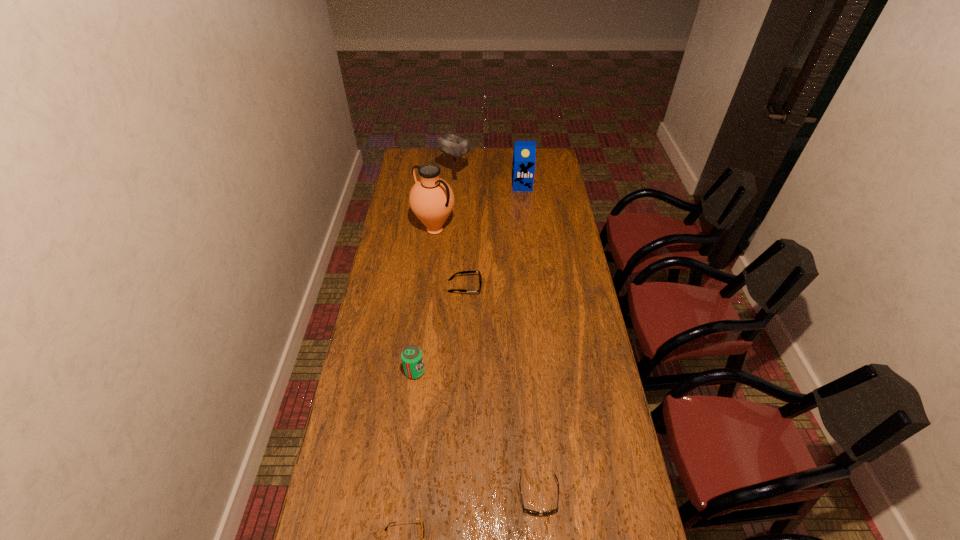
At what (x,y) coordinates should I click in order to perform the action: click on free space located on the back of the mallet. Please return your answer as a coordinate pair (x, y). The height and width of the screenshot is (540, 960). Looking at the image, I should click on (456, 166).

What are the coordinates of `free space located with the cap open on the carton` in the screenshot? It's located at (527, 229).

Identify the location of free space located on the front-facing side of the fourth shortest object. (512, 372).

Find the location of a particular element. This screenshot has width=960, height=540. vacant space positioned on the front-facing side of the second sunglasses from left to right is located at coordinates (498, 286).

The width and height of the screenshot is (960, 540). Find the location of `blank area located 0.050m on the lenses of the sixth farthest object`. blank area located 0.050m on the lenses of the sixth farthest object is located at coordinates (542, 536).

Identify the location of object present at the left edge. (431, 199).

In the image, there is a desktop. At what (x,y) coordinates should I click in order to perform the action: click on free space at the left edge. Please return your answer as a coordinate pair (x, y). Looking at the image, I should click on (344, 429).

Where is `vacant space at the right edge`? The height and width of the screenshot is (540, 960). vacant space at the right edge is located at coordinates (594, 447).

Locate an element on the screen. This screenshot has width=960, height=540. vacant point at the far right corner is located at coordinates (545, 163).

At what (x,y) coordinates should I click in order to perform the action: click on free area in between the farthest sunglasses and the mallet. Please return your answer as a coordinate pair (x, y). This screenshot has width=960, height=540. Looking at the image, I should click on (460, 233).